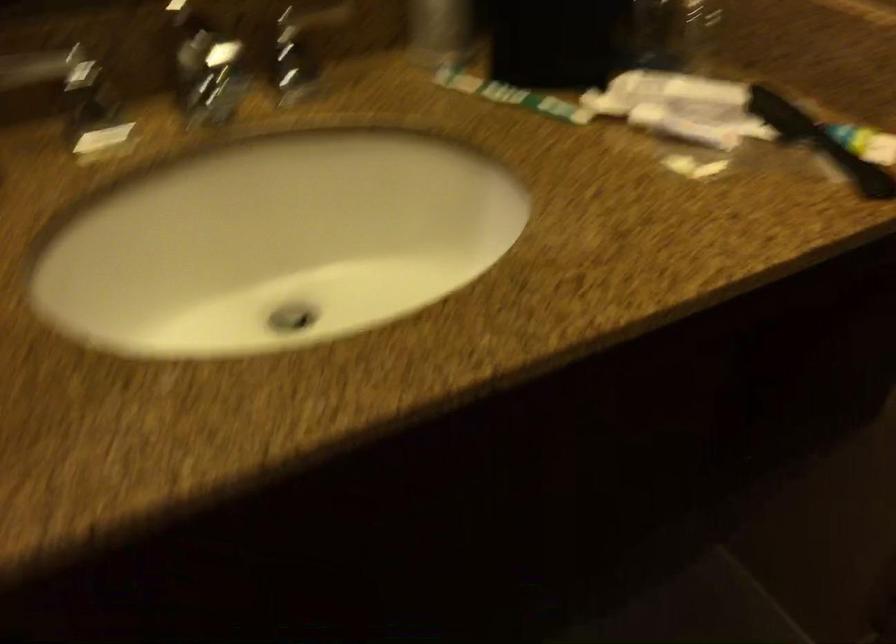
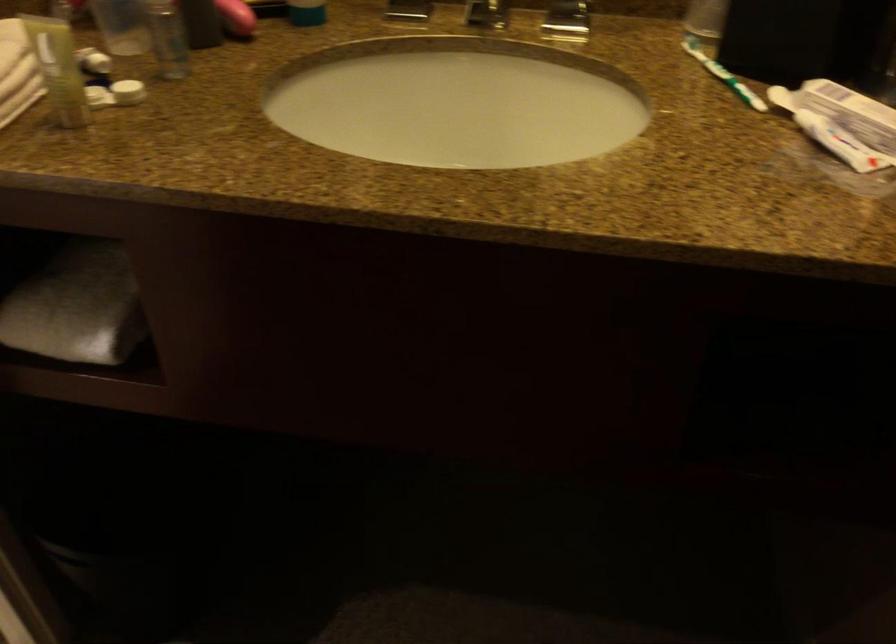
The point at (305,80) is marked in the first image. Where is the corresponding point in the second image?

(566, 21)